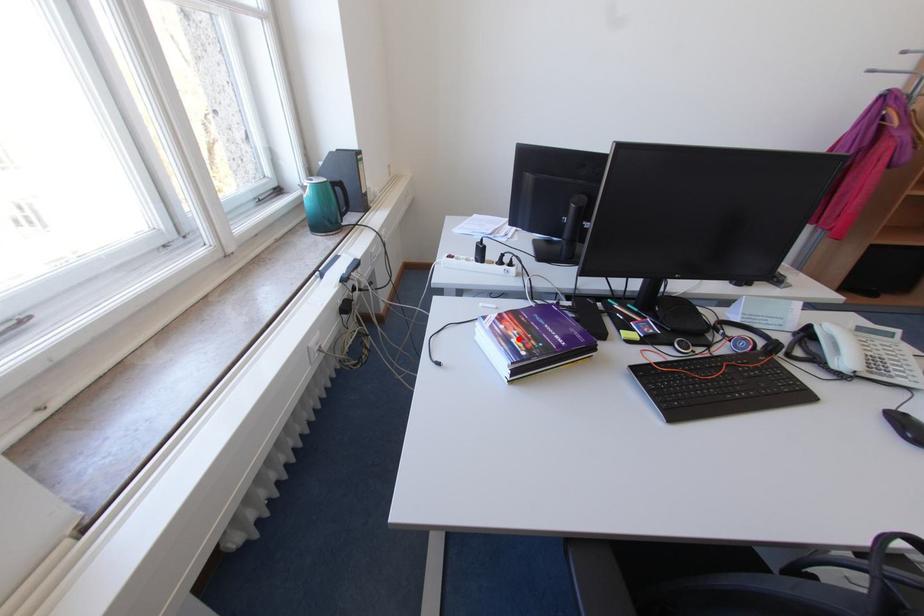
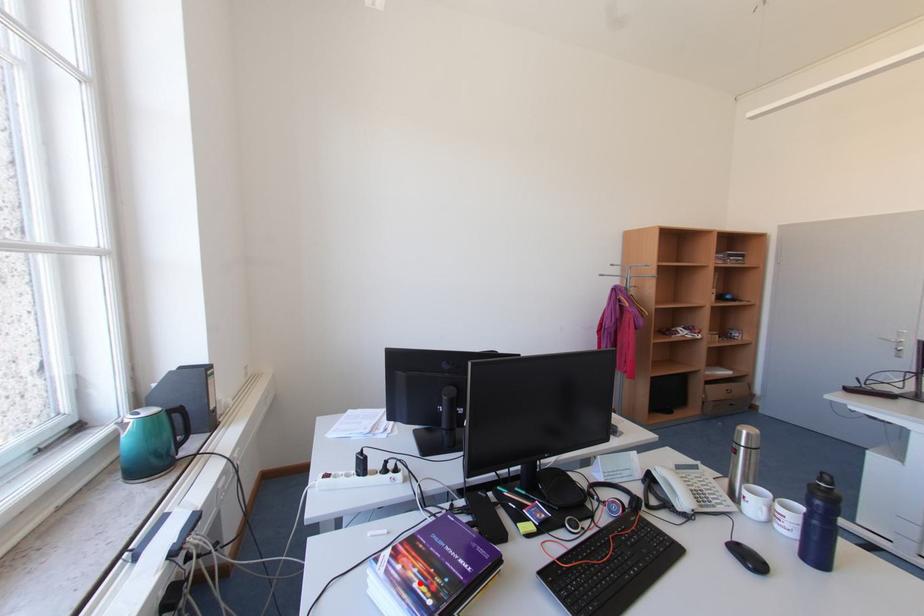
I am providing you with two images of the same scene from different viewpoints. A red point is marked on the first image and another point is marked on the second image. Do the highlighted points in image1 and image2 indicate the same real-world spot?

Yes